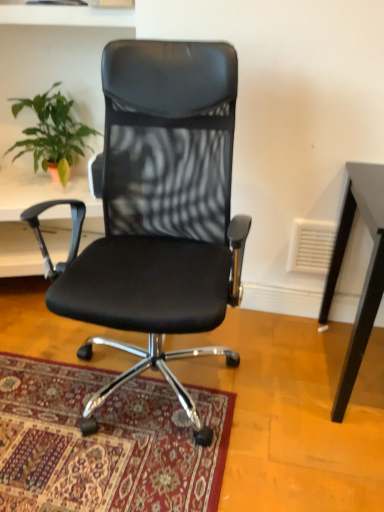
At what (x,y) coordinates should I click in order to perform the action: click on vacant area that is situated to the right of black leather office chair at center. Please return your answer as a coordinate pair (x, y). The width and height of the screenshot is (384, 512). Looking at the image, I should click on (288, 387).